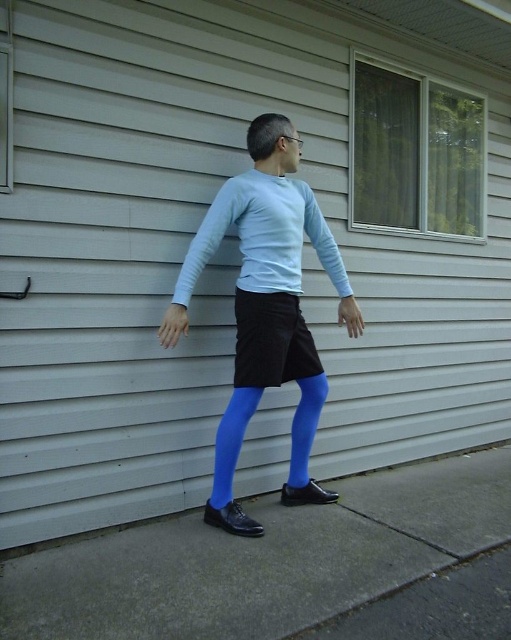
You are a delivery robot that is 1.5 meters tall. You need to deliver a package to the person standing on the smooth concrete pavement at lower center. Can you reach them without needing to move closer?

The smooth concrete pavement at lower center and viewer are 1.72 meters apart from each other. Since the delivery robot is 1.5 meters tall, it can reach the person as the distance between them is within the robot arm length.

You are a delivery robot that needs to place a package on the smooth concrete pavement at lower center. The package is 60 centimeters wide. Can you safely place the package without it overlapping the blue matte tights at center?

The smooth concrete pavement at lower center is 57.90 centimeters from blue matte tights at center. Since the package is 60 centimeters wide, it would overlap the blue matte tights at center, so you cannot safely place the package there.